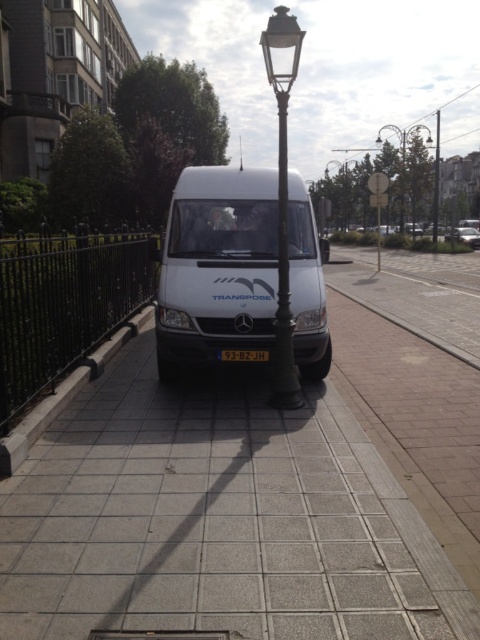
You are standing on the sidewalk and see the white van parked next to the street. There is a point marked at coordinates (243, 355). What object is located at that point?

The point at coordinates (243, 355) indicates the location of the black plastic license plate at center.

You are a delivery person who needs to verify the license plate number of the metallic silver van at center. You have a camera that can only capture objects wider than the black plastic license plate at center. Will the camera be able to capture the license plate number clearly?

The black plastic license plate at center has a lesser width compared to the metallic silver van at center. However, the question is about capturing the license plate itself, not the van. Since the camera requires objects wider than the license plate, and the license plate is the object in question, the camera cannot capture it as it is narrower than the required minimum width.

You are a delivery person who needs to load a tall package into the van. The package is 1.5 meters in height. Can the package fit vertically inside the white matte van at center if the height of the black plastic license plate at center is 15 centimeters?

The white matte van at center is much taller than the black plastic license plate at center, which is 15 centimeters. Since the van is significantly taller, the 1.5 meters tall package can likely fit vertically inside the white matte van at center.